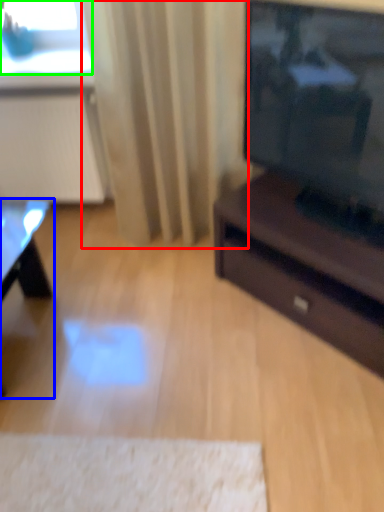
Question: Which is nearer to the curtain (highlighted by a red box)? table (highlighted by a blue box) or window screen (highlighted by a green box).

Choices:
 (A) table
 (B) window screen

Answer: (B)